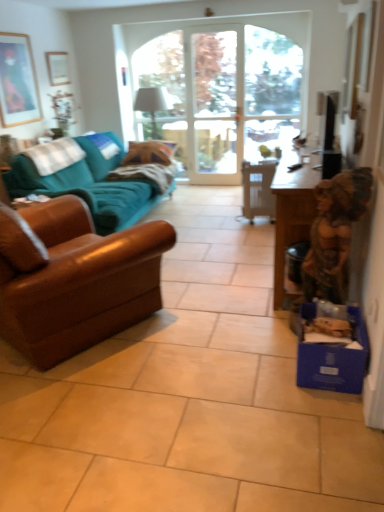
At what (x,y) coordinates should I click in order to perform the action: click on free space in front of blue cardboard box at lower right. Please return your answer as a coordinate pair (x, y). This screenshot has width=384, height=512. Looking at the image, I should click on (329, 412).